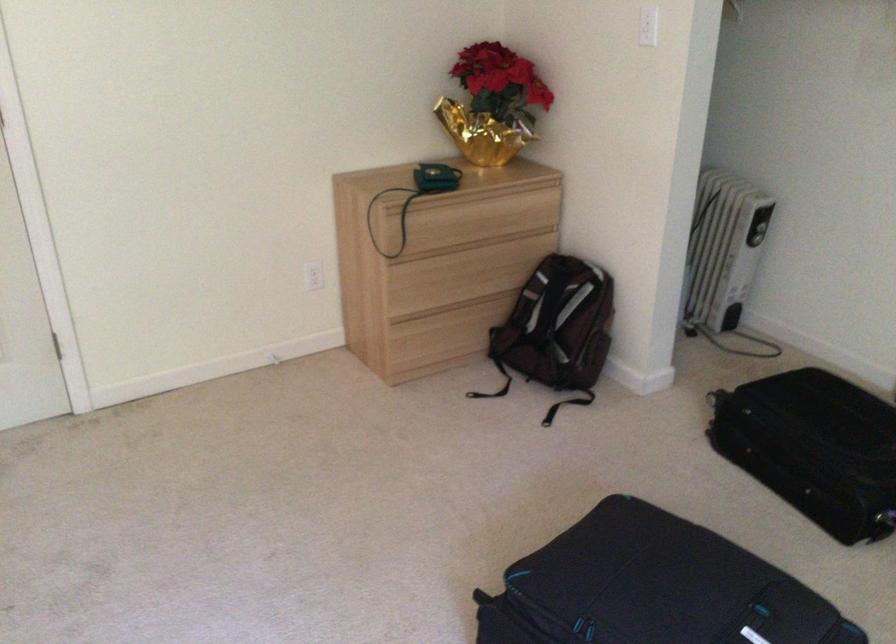
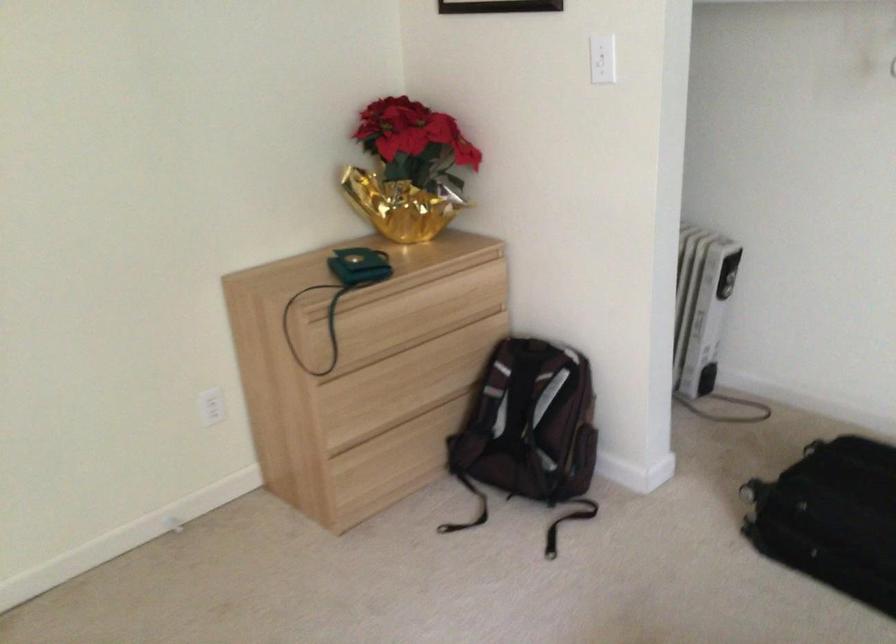
Find the pixel in the second image that matches (426,232) in the first image.

(362, 335)